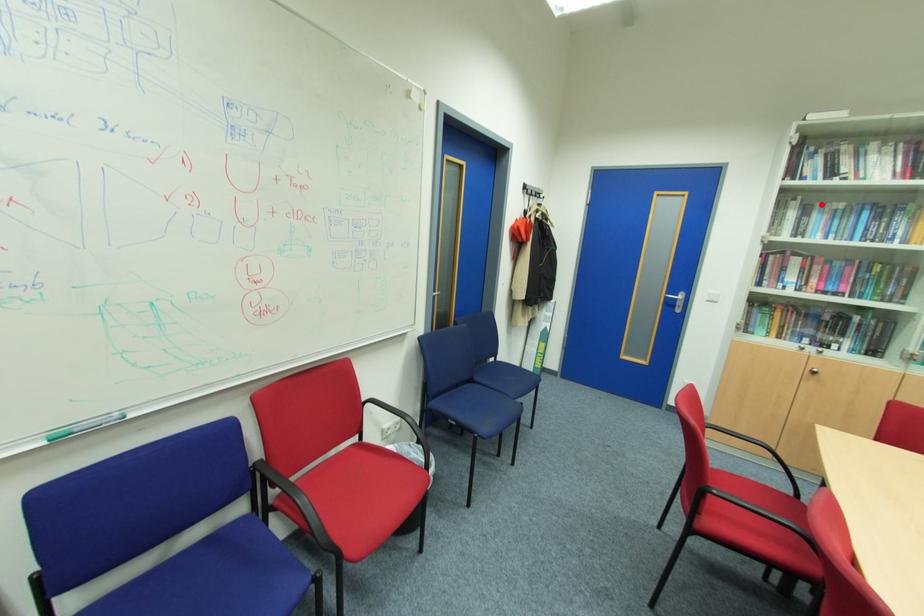
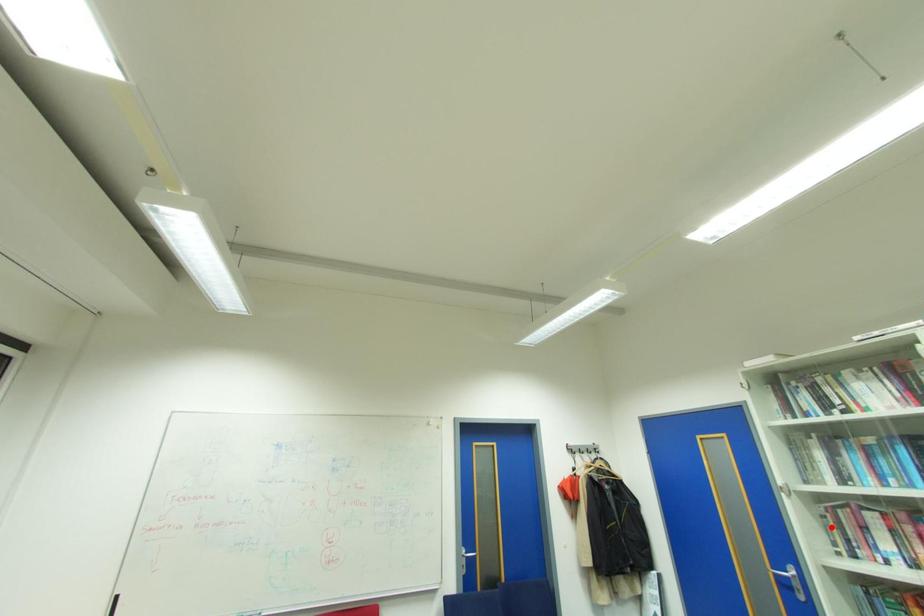
I am providing you with two images of the same scene from different viewpoints. A red point is marked on the first image and another point is marked on the second image. Do the highlighted points in image1 and image2 indicate the same real-world spot?

No